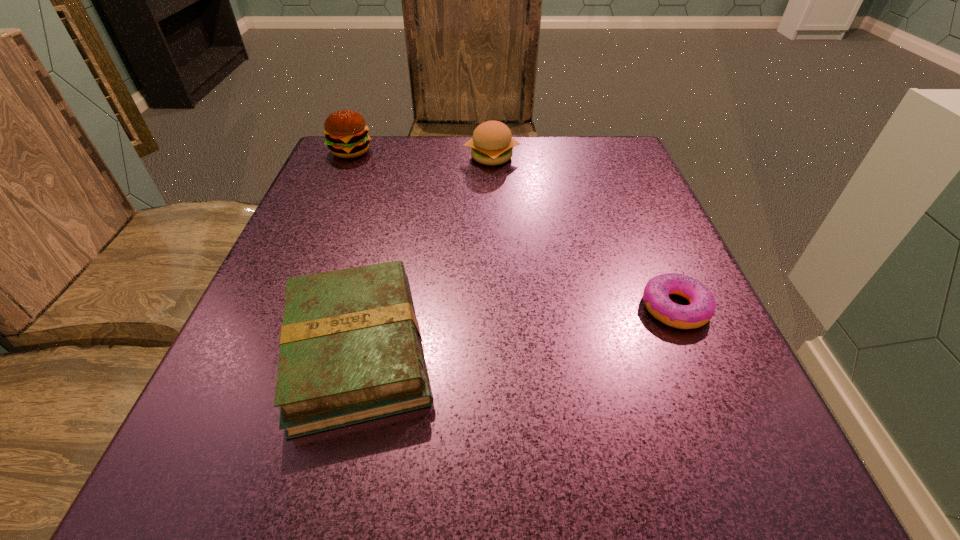
This screenshot has width=960, height=540. What are the coordinates of `hamburger at the left edge` in the screenshot? It's located at (346, 132).

At what (x,y) coordinates should I click in order to perform the action: click on book present at the left edge. Please return your answer as a coordinate pair (x, y). The height and width of the screenshot is (540, 960). Looking at the image, I should click on (351, 351).

The width and height of the screenshot is (960, 540). I want to click on object located in the right edge section of the desktop, so click(656, 299).

Where is `object that is positioned at the far left corner`? This screenshot has width=960, height=540. object that is positioned at the far left corner is located at coordinates (346, 132).

Identify the location of object at the near left corner. (351, 351).

The image size is (960, 540). I want to click on vacant space at the far edge of the desktop, so click(540, 186).

In the image, there is a desktop. Identify the location of free region at the near edge. The height and width of the screenshot is (540, 960). (432, 461).

This screenshot has width=960, height=540. I want to click on vacant space at the left edge, so click(239, 384).

Identify the location of vacant space at the right edge of the desktop. This screenshot has width=960, height=540. (654, 268).

You are a GUI agent. You are given a task and a screenshot of the screen. Output one action in this format:
    pyautogui.click(x=<x>, y=<y>)
    Task: Click on the free space at the near left corner of the desktop
    
    Given the screenshot: What is the action you would take?
    pyautogui.click(x=241, y=518)